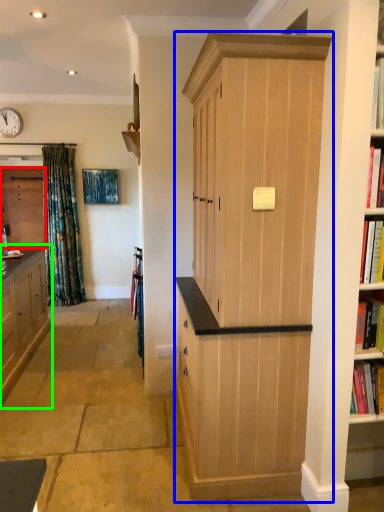
Question: Considering the real-world distances, which object is farthest from cabinetry (highlighted by a red box)? cabinetry (highlighted by a blue box) or cabinetry (highlighted by a green box)?

Choices:
 (A) cabinetry
 (B) cabinetry

Answer: (A)